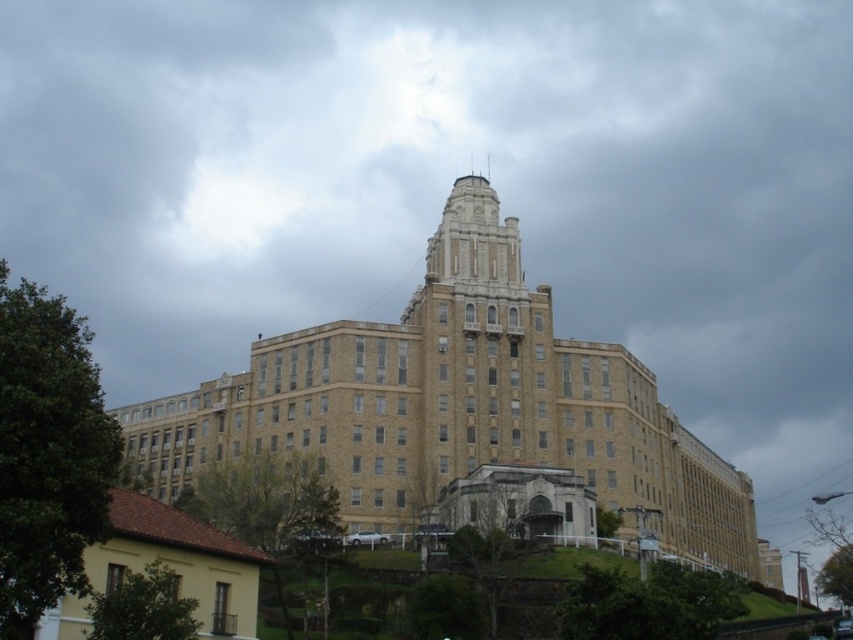
In the scene shown: You are standing at the base of the beige stone building at center and want to see the yellow matte house at lower left. Considering their heights, which building will appear taller from your vantage point?

The beige stone building at center appears taller from your vantage point because it has a greater height compared to the yellow matte house at lower left.